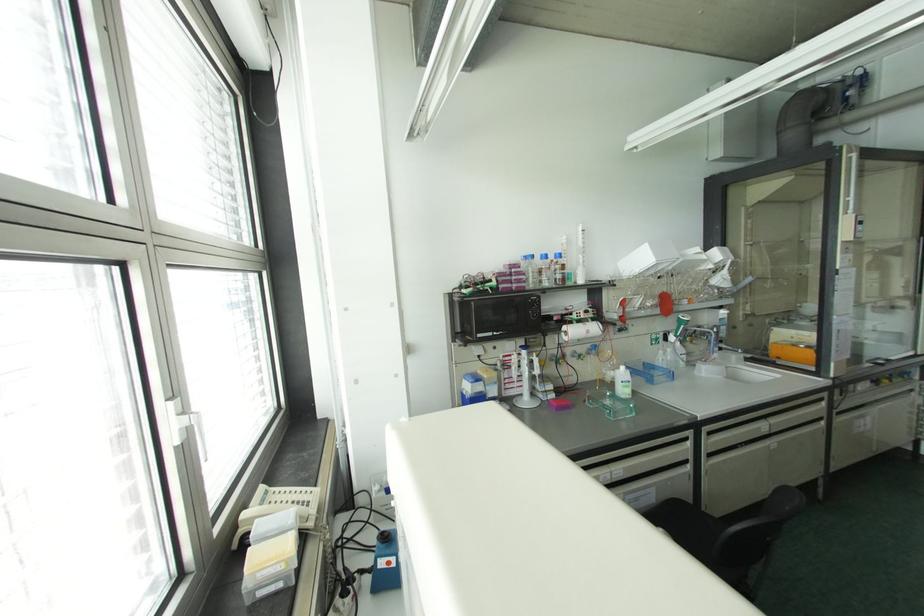
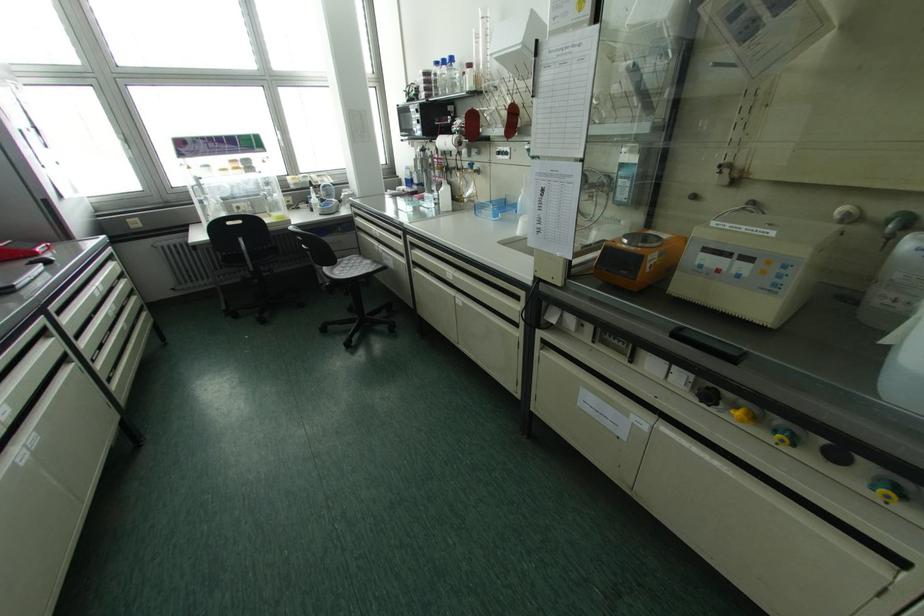
In the second image, find the point that corresponds to point (558, 254) in the first image.

(451, 59)